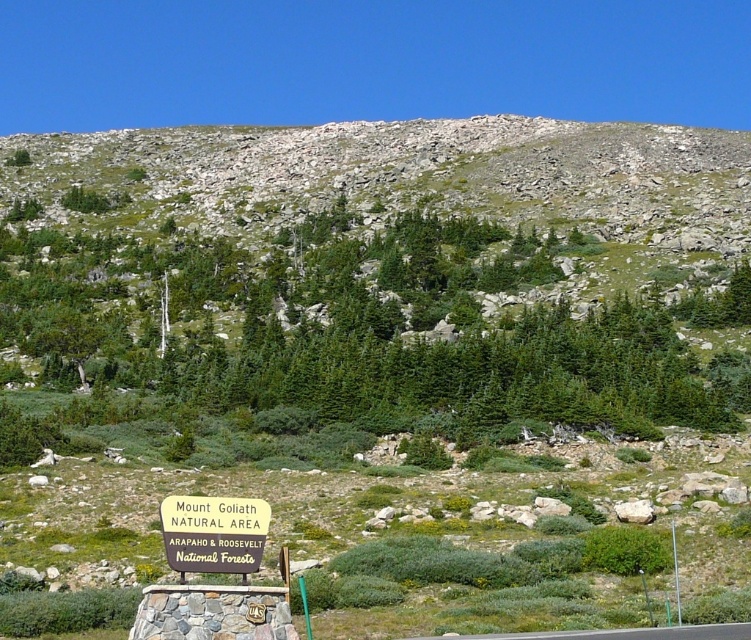
Who is more forward, (x=731, y=212) or (x=255, y=499)?

Positioned in front is point (x=255, y=499).

Which of these two, green grassy hillside at upper center or yellow wood sign at lower center, stands taller?

green grassy hillside at upper center

Is point (288, 138) less distant than point (252, 513)?

No, (288, 138) is behind (252, 513).

Where is `green grassy hillside at upper center`? The height and width of the screenshot is (640, 751). green grassy hillside at upper center is located at coordinates (415, 172).

Which is above, green evergreen tree at center or green grassy hillside at upper center?

green grassy hillside at upper center is higher up.

Is point (56, 371) closer to camera compared to point (0, 136)?

Yes, it is in front of point (0, 136).

The image size is (751, 640). Identify the location of green evergreen tree at center. (363, 332).

This screenshot has width=751, height=640. What are the coordinates of `green evergreen tree at center` in the screenshot? It's located at (363, 332).

Which is behind, point (454, 401) or point (243, 554)?

The point (454, 401) is more distant.

The width and height of the screenshot is (751, 640). Identify the location of green evergreen tree at center. (363, 332).

Locate an element on the screen. green evergreen tree at center is located at coordinates (363, 332).

Image resolution: width=751 pixels, height=640 pixels. Identify the location of green evergreen tree at center. (363, 332).